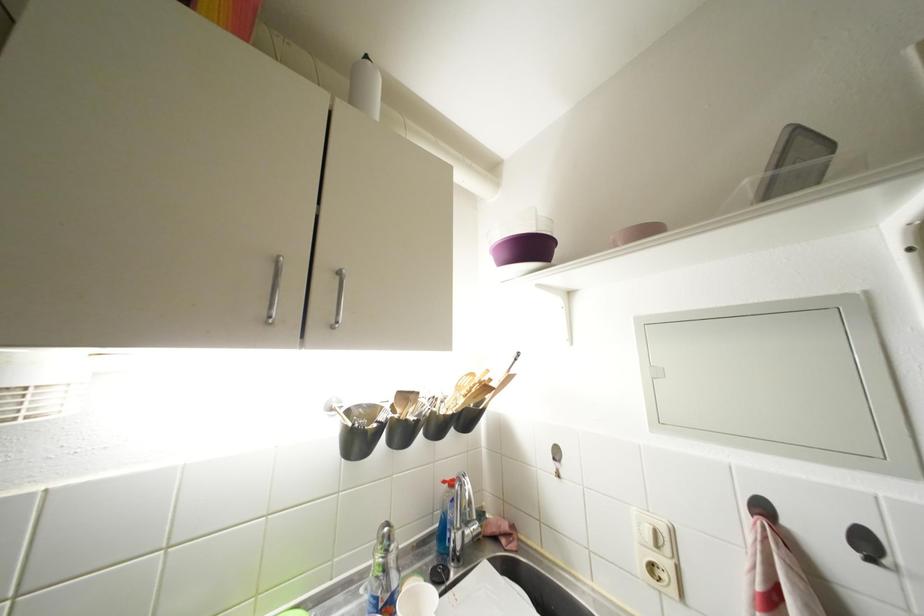
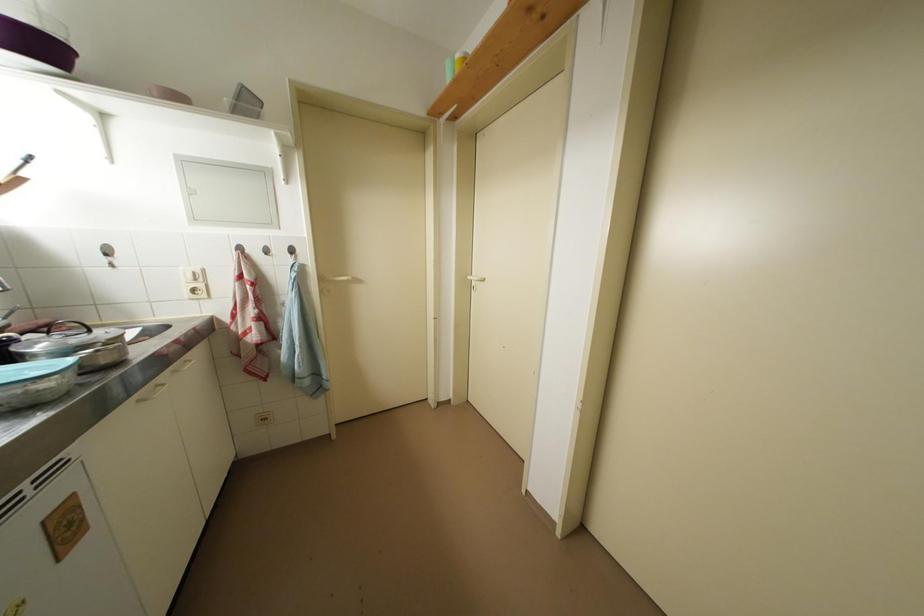
Based on the continuous images, in which direction is the camera rotating?

The camera's rotation is toward right-down.